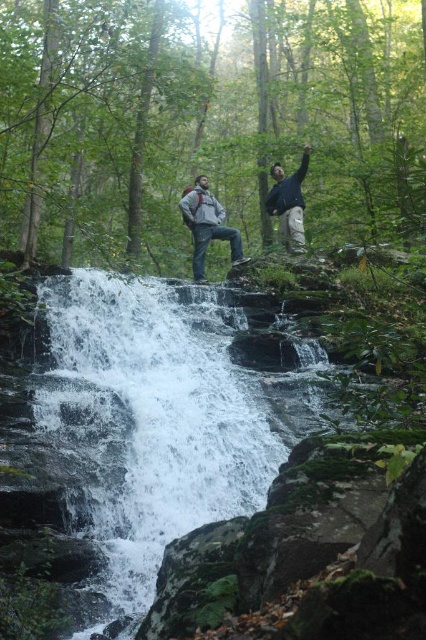
You are a photographer trying to capture both the gray matte jacket at center and the dark blue jacket at upper center in a single frame. Based on their positions, which jacket might require you to adjust your camera angle to include both?

The gray matte jacket at center might be wider than dark blue jacket at upper center, so adjusting the camera angle to account for its width could help include both in the frame.

You are a photographer standing at the edge of a waterfall. You see a matte gray jacket at center and a camera. You want to take a photo of the waterfall. Which item should you use and why?

You should use the camera because it is the tool designed for taking photos, while the matte gray jacket at center is an article of clothing and not meant for capturing images.